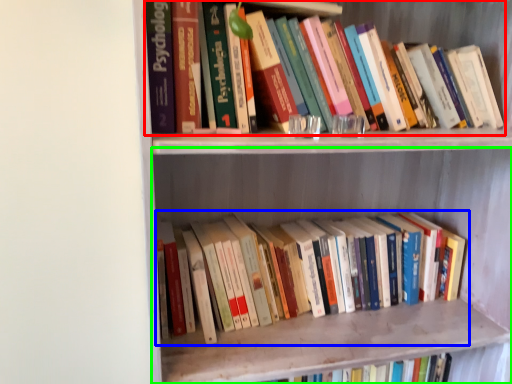
Question: Which is nearer to the book (highlighted by a red box)? book (highlighted by a blue box) or shelf (highlighted by a green box).

Choices:
 (A) book
 (B) shelf

Answer: (B)